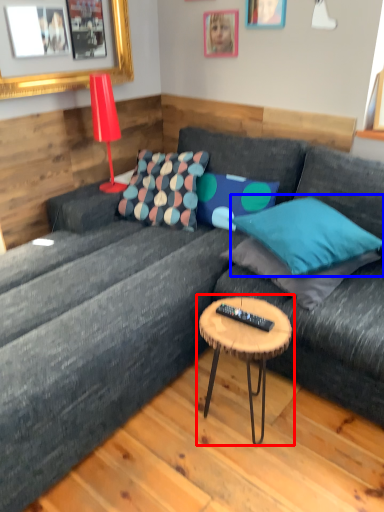
Question: Which of the following is the closest to the observer, coffee table (highlighted by a red box) or pillow (highlighted by a blue box)?

Choices:
 (A) coffee table
 (B) pillow

Answer: (A)